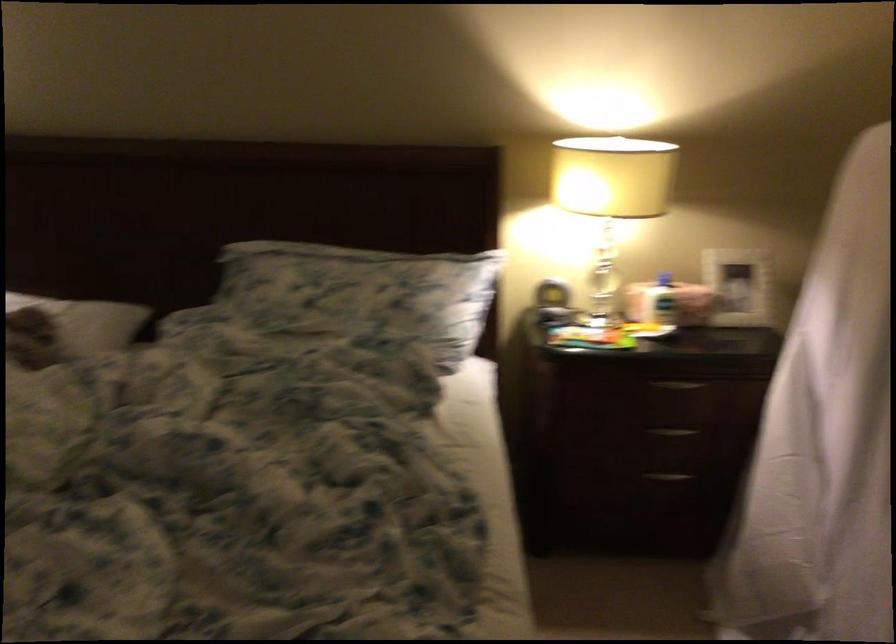
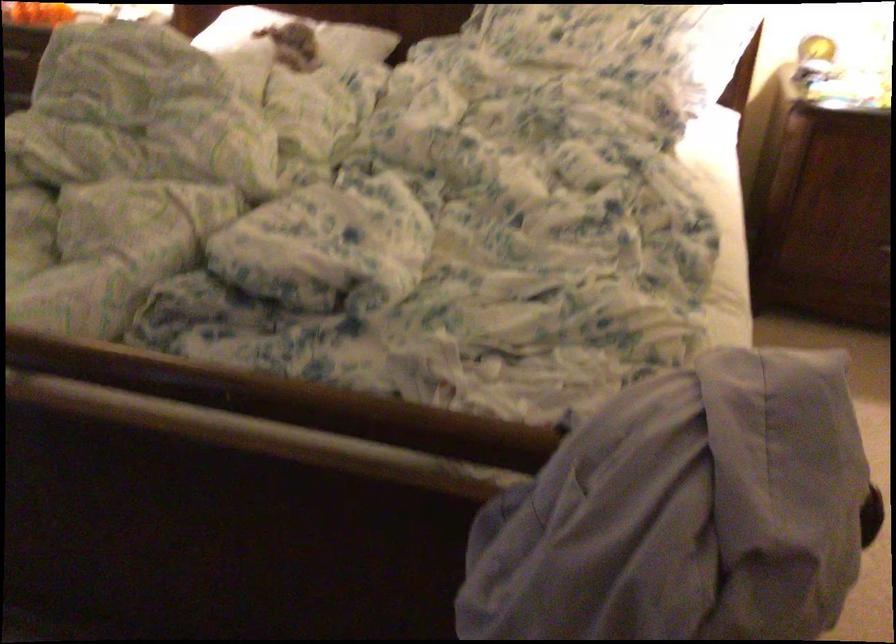
Question: The first image is from the beginning of the video and the second image is from the end. How did the camera likely rotate when shooting the video?

Choices:
 (A) Left
 (B) Right
 (C) Up
 (D) Down

Answer: (D)